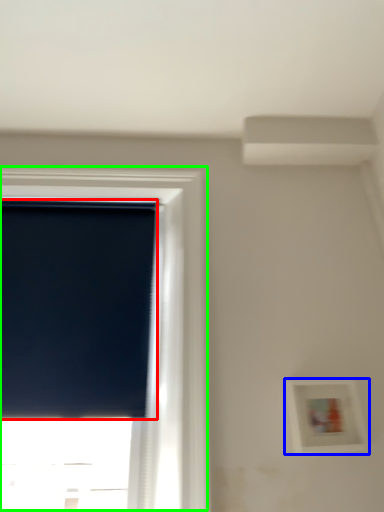
Question: Which object is the farthest from window screen (highlighted by a red box)? Choose among these: picture frame (highlighted by a blue box) or window (highlighted by a green box).

Choices:
 (A) picture frame
 (B) window

Answer: (A)